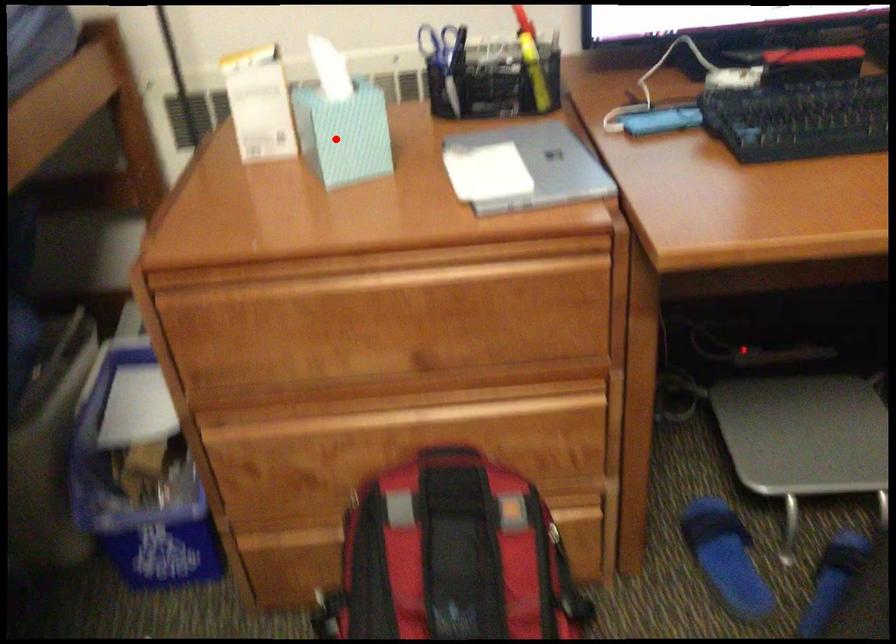
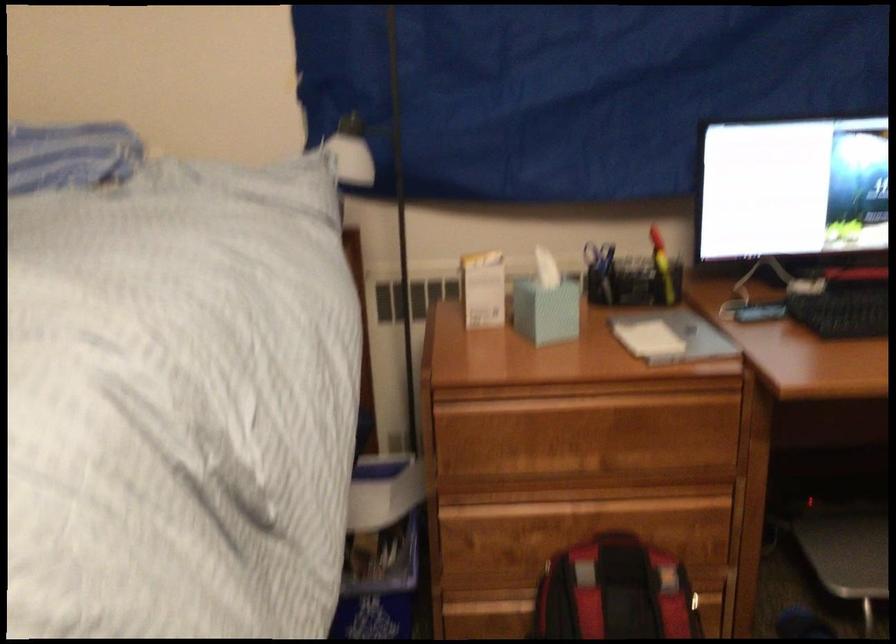
Locate, in the second image, the point that corresponds to the highlighted location in the first image.

(546, 310)